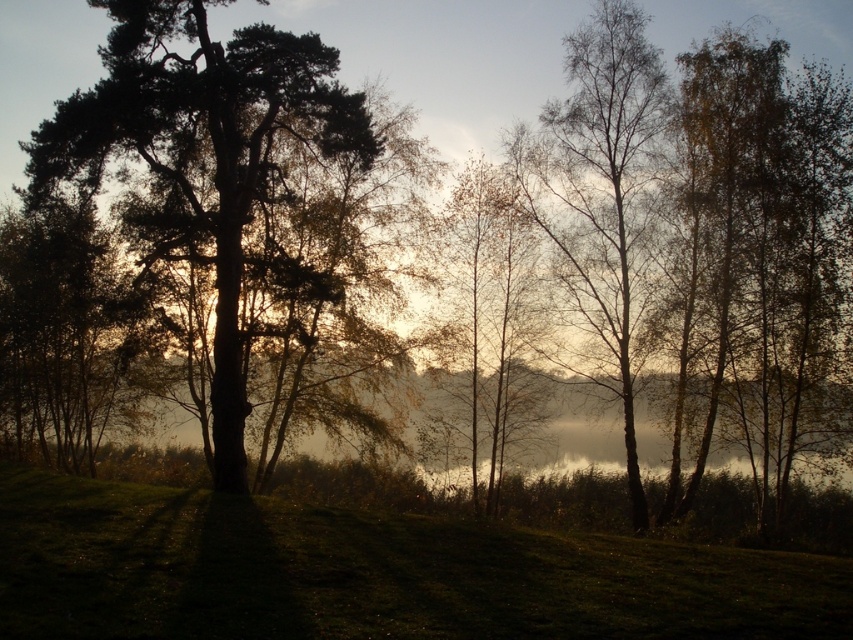
Does dark green textured tree at left appear under bare birch tree at right?

Actually, dark green textured tree at left is above bare birch tree at right.

Does dark green textured tree at left have a greater height compared to bare birch tree at right?

No, dark green textured tree at left is not taller than bare birch tree at right.

Between point (271, 131) and point (646, 96), which one is positioned in front?

Positioned in front is point (271, 131).

In order to click on dark green textured tree at left in this screenshot , I will do `click(207, 163)`.

From the picture: Can you confirm if green grassy hillside at lower center is positioned below bare birch tree at right?

Yes.

Does point (102, 612) come closer to viewer compared to point (554, 259)?

Yes.

Locate an element on the screen. green grassy hillside at lower center is located at coordinates (372, 573).

Can you confirm if green grassy hillside at lower center is positioned below dark green textured tree at left?

Correct, green grassy hillside at lower center is located below dark green textured tree at left.

This screenshot has height=640, width=853. Identify the location of green grassy hillside at lower center. (372, 573).

Identify the location of green grassy hillside at lower center. (372, 573).